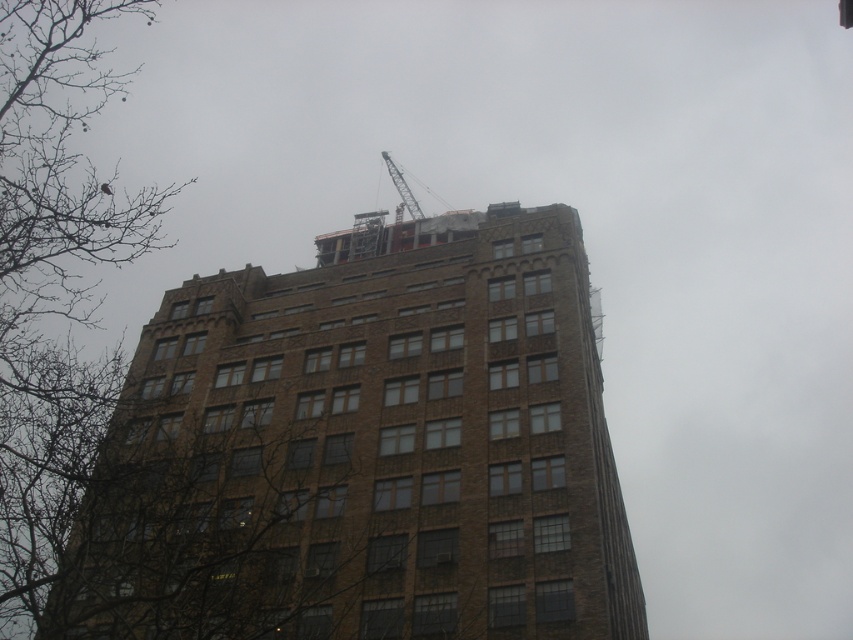
Based on the photo, you are a construction worker planning to install a new flagpole on the roof of the brown brick building at center. The flagpole needs to be 10 meters shorter than the building. Given the relationship between the building and the metallic gray crane at top, can you determine if the flagpole will be shorter than the crane?

The brown brick building at center is much taller than the metallic gray crane at top. Since the flagpole needs to be 10 meters shorter than the building, it will still be shorter than the crane because the building is significantly taller than the crane.

In the scene shown: You are an architect reviewing the construction site. You need to determine if the brown brick building at center can accommodate the metallic gray crane at top in terms of width. Based on the provided information, can the crane fit horizontally within the building?

The brown brick building at center might be wider than metallic gray crane at top, so the crane could potentially fit horizontally within the building if the building is indeed wider. However, the exact dimensions are uncertain without further measurements.

You are standing at the origin point of a coordinate system where the image is mapped. The brown brick building at center is at coordinates approximately 0.703 in the x and 0.428 in the y. If you want to move directly towards the building, which direction should you head in from your current position at the origin?

The brown brick building at center is located at coordinates approximately 0.703 in the x and 0.428 in the y. To move directly towards it from the origin, you should head northeast since the x and y values are both positive and greater than zero.